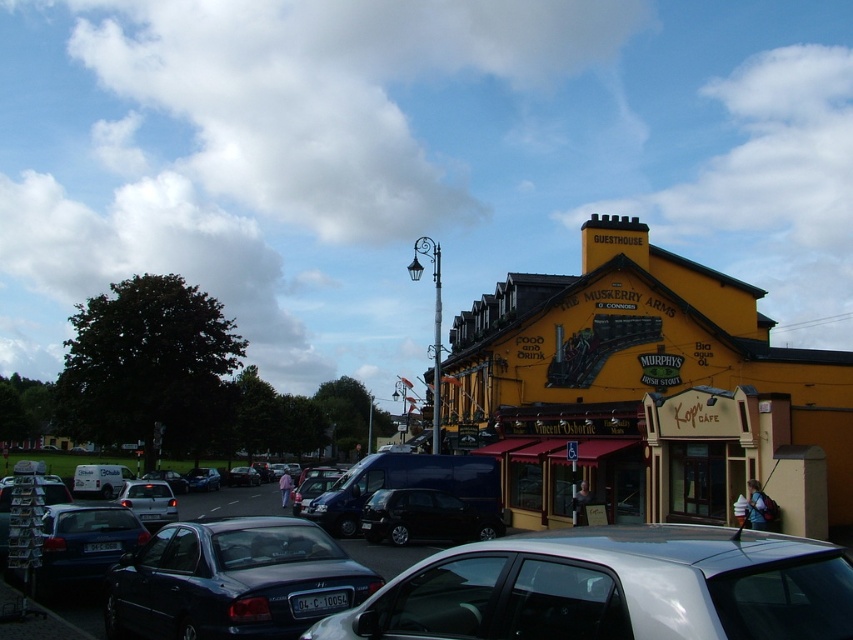
You are a delivery person trying to park your van in the street in front of the yellow painted building at center. There is a silver metallic car at lower center blocking the path. Can you drive your van around the car to reach the building?

The yellow painted building at center is positioned over the silver metallic car at lower center, meaning the car is parked directly in front of the building. To reach the building, you would need to maneuver around the car either by going around it on the side or waiting for it to leave.

You are a pedestrian standing at the crosswalk and see the metallic blue sedan at lower left and the metallic silver car at center. Which car is positioned higher up in the image?

The metallic blue sedan at lower left is positioned above the metallic silver car at center in the image.